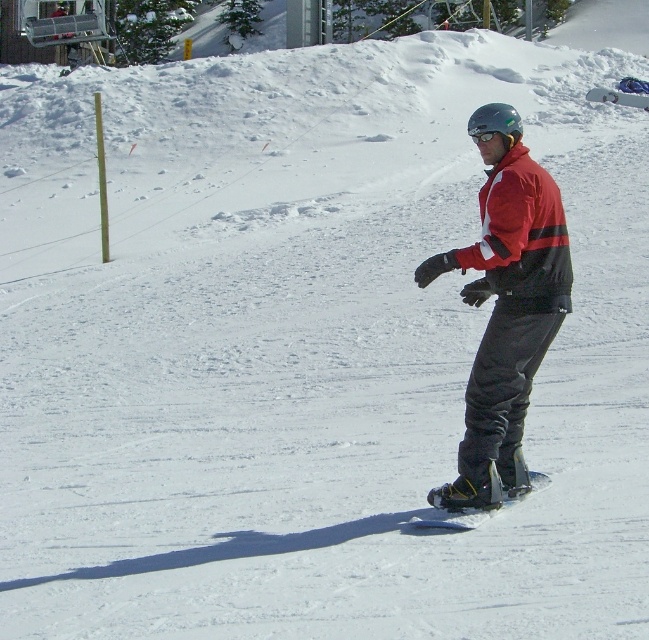
You are a photographer trying to capture the snowboarder in the scene. You want to ensure both the red matte jacket at center and the black matte snowboard at center are clearly visible in your photo. Which object should you focus on first to ensure proper focus, considering their sizes?

The red matte jacket at center has a greater height compared to the black matte snowboard at center, so focusing on the red matte jacket at center first will ensure proper focus due to its larger size.

You are a photographer trying to capture the snowboarder in the scene. You want to position yourself so that the red matte jacket at center and the matte black snowboard at center are both visible in your shot. Based on their positions, which object should you place closer to the left side of your camera frame?

The red matte jacket at center is to the left of the matte black snowboard at center, so you should position the red matte jacket at center closer to the left side of your camera frame.